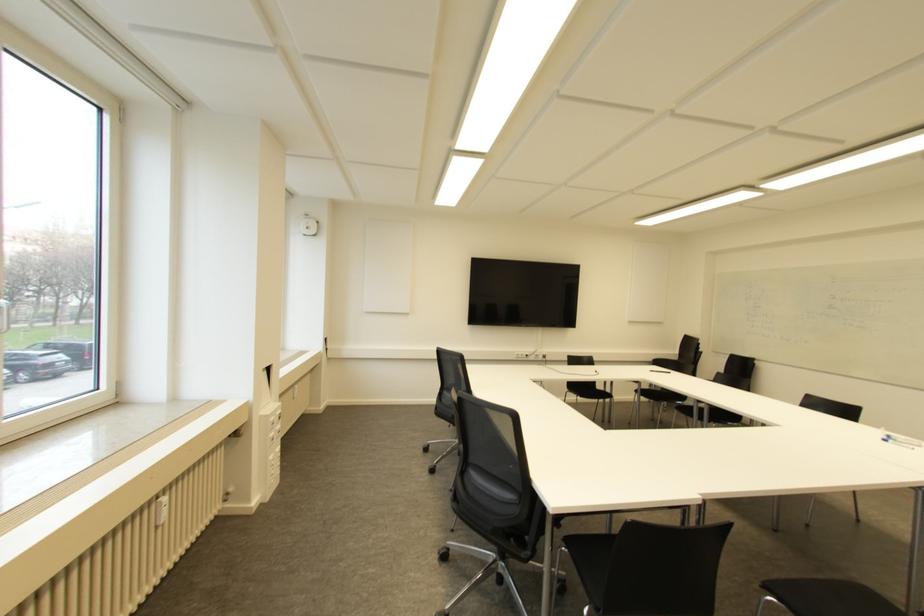
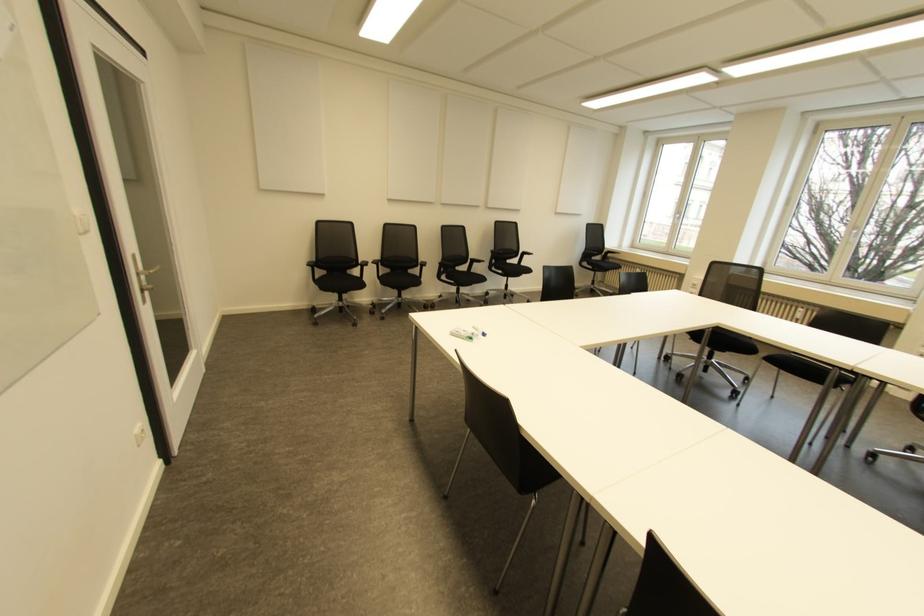
Question: I am providing you with two images of the same scene from different viewpoints. After the viewpoint changes to image2, which objects are now occluded?

Choices:
 (A) black chair sitting surface
 (B) small plastic box
 (C) patterned sofa sitting surface
 (D) white window handle

Answer: (A)